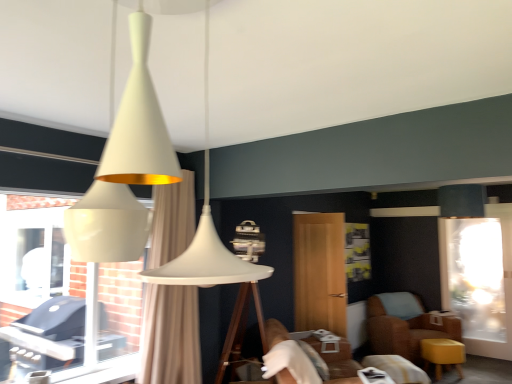
Question: Does brown leather chair at lower right have a lesser height compared to matte yellow stool at lower right?

Choices:
 (A) yes
 (B) no

Answer: (B)

Question: From the image's perspective, is brown leather chair at lower right on top of matte yellow stool at lower right?

Choices:
 (A) yes
 (B) no

Answer: (A)

Question: Considering the relative sizes of brown leather chair at lower right and matte yellow stool at lower right in the image provided, is brown leather chair at lower right bigger than matte yellow stool at lower right?

Choices:
 (A) yes
 (B) no

Answer: (A)

Question: From a real-world perspective, is brown leather chair at lower right located higher than matte yellow stool at lower right?

Choices:
 (A) no
 (B) yes

Answer: (B)

Question: Does brown leather chair at lower right come behind matte yellow stool at lower right?

Choices:
 (A) no
 (B) yes

Answer: (B)

Question: Is brown leather chair at lower right closer to camera compared to matte yellow stool at lower right?

Choices:
 (A) no
 (B) yes

Answer: (A)

Question: Is white glossy grill at left placed right next to satin black lampshade at upper right?

Choices:
 (A) yes
 (B) no

Answer: (B)

Question: Can you confirm if white glossy grill at left is shorter than satin black lampshade at upper right?

Choices:
 (A) yes
 (B) no

Answer: (B)

Question: Is white glossy grill at left looking in the opposite direction of satin black lampshade at upper right?

Choices:
 (A) yes
 (B) no

Answer: (B)

Question: Is the depth of white glossy grill at left less than that of satin black lampshade at upper right?

Choices:
 (A) no
 (B) yes

Answer: (B)

Question: From the image's perspective, does white glossy grill at left appear higher than satin black lampshade at upper right?

Choices:
 (A) yes
 (B) no

Answer: (B)

Question: Can satin black lampshade at upper right be found inside white glossy grill at left?

Choices:
 (A) yes
 (B) no

Answer: (B)

Question: Is wooden screen door at center, which ranks as the first screen door in left-to-right order, not near matte yellow stool at lower right?

Choices:
 (A) no
 (B) yes

Answer: (B)